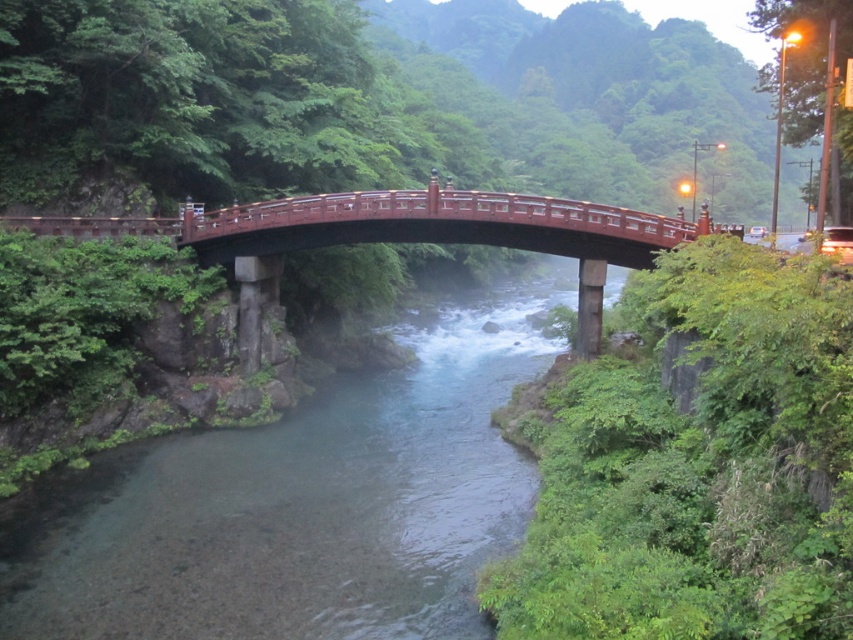
You are a boat captain planning to navigate a narrow boat through the river shown in the image. The boat requires a water channel width of at least 10 meters to pass safely. Given the information about the clear water at center and the shiny lacquered bridge at center, can you determine if the water channel under the bridge is wide enough for your boat?

The clear water at center has a larger width than the shiny lacquered bridge at center. Since the boat requires a minimum of 10 meters to pass safely, and the water channel is wider than the bridge, it is likely that the water channel under the bridge meets the required width. However, without specific measurements, we can only confirm that the water is wider than the bridge, so it might be sufficient.

You are a hiker who wants to cross the river using the bridge. However, you notice the clear water at center and the shiny lacquered bridge at center. Which object is higher in elevation?

The clear water at center is much taller than the shiny lacquered bridge at center, so the clear water at center is higher in elevation.

You are a tourist visiting the bridge and want to take a photo of the clear water at center and the shiny lacquered bridge at center. Which object should you focus on first if you want to capture both in one shot?

You should focus on the shiny lacquered bridge at center first because the clear water at center is below it, ensuring both are in frame when centered on the bridge.